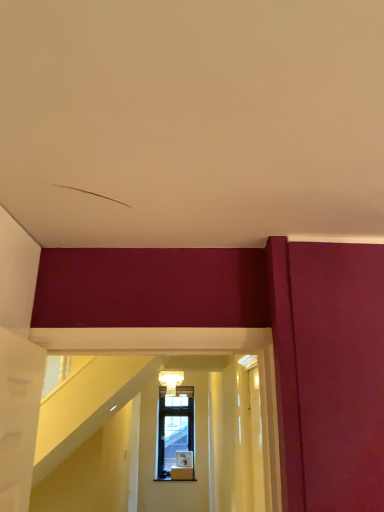
Image resolution: width=384 pixels, height=512 pixels. Describe the element at coordinates (171, 381) in the screenshot. I see `matte white light fixture at center` at that location.

What are the coordinates of `matte white light fixture at center` in the screenshot? It's located at (171, 381).

Describe the element at coordinates (251, 438) in the screenshot. The height and width of the screenshot is (512, 384). I see `transparent glass door at right` at that location.

What is the approximate height of transparent glass door at right?

It is 28.79 inches.

Where is `transparent glass door at right`? The width and height of the screenshot is (384, 512). transparent glass door at right is located at coordinates (251, 438).

Find the location of a particular element. matte white light fixture at center is located at coordinates (171, 381).

Is transparent glass door at right at the right side of matte white light fixture at center?

Correct, you'll find transparent glass door at right to the right of matte white light fixture at center.

Which is in front, transparent glass door at right or matte white light fixture at center?

transparent glass door at right is closer to the camera.

Considering the positions of point (247, 478) and point (173, 377), is point (247, 478) closer or farther from the camera than point (173, 377)?

Point (247, 478) appears to be closer to the viewer than point (173, 377).

From the image's perspective, is transparent glass door at right below matte white light fixture at center?

No.

From a real-world perspective, is transparent glass door at right physically above matte white light fixture at center?

No, from a real-world perspective, transparent glass door at right is not above matte white light fixture at center.

Considering the sizes of transparent glass door at right and matte white light fixture at center in the image, is transparent glass door at right wider or thinner than matte white light fixture at center?

In the image, transparent glass door at right appears to be more narrow than matte white light fixture at center.

Does transparent glass door at right have a lesser height compared to matte white light fixture at center?

No.

Can you confirm if transparent glass door at right is bigger than matte white light fixture at center?

Yes.

Is transparent glass door at right not inside matte white light fixture at center?

That's correct, transparent glass door at right is outside of matte white light fixture at center.

Are transparent glass door at right and matte white light fixture at center far apart?

Indeed, transparent glass door at right is not near matte white light fixture at center.

Is transparent glass door at right facing away from matte white light fixture at center?

transparent glass door at right does not have its back to matte white light fixture at center.

Where is `glass door on the right of matte white light fixture at center`? The image size is (384, 512). glass door on the right of matte white light fixture at center is located at coordinates (251, 438).

Does matte white light fixture at center appear on the left side of transparent glass door at right?

Indeed, matte white light fixture at center is positioned on the left side of transparent glass door at right.

Considering the relative positions of matte white light fixture at center and transparent glass door at right in the image provided, is matte white light fixture at center in front of transparent glass door at right?

That is False.

Is point (173, 376) more distant than point (250, 435)?

Yes, it is behind point (250, 435).

Consider the image. From the image's perspective, which is above, matte white light fixture at center or transparent glass door at right?

transparent glass door at right, from the image's perspective.

From a real-world perspective, is matte white light fixture at center positioned over transparent glass door at right based on gravity?

Yes.

Is matte white light fixture at center thinner than transparent glass door at right?

In fact, matte white light fixture at center might be wider than transparent glass door at right.

Looking at this image, does matte white light fixture at center have a greater height compared to transparent glass door at right?

No, matte white light fixture at center is not taller than transparent glass door at right.

In the scene shown: Can you confirm if matte white light fixture at center is bigger than transparent glass door at right?

No, matte white light fixture at center is not bigger than transparent glass door at right.

Would you say matte white light fixture at center is inside or outside transparent glass door at right?

matte white light fixture at center is spatially situated outside transparent glass door at right.

Would you say matte white light fixture at center is a long distance from transparent glass door at right?

Yes.

Is transparent glass door at right at the back of matte white light fixture at center?

That's not correct — matte white light fixture at center is not looking away from transparent glass door at right.

How many degrees apart are the facing directions of matte white light fixture at center and transparent glass door at right?

88.2 degrees separate the facing orientations of matte white light fixture at center and transparent glass door at right.

This screenshot has height=512, width=384. Find the location of `glass door on the right of matte white light fixture at center`. glass door on the right of matte white light fixture at center is located at coordinates (251, 438).

Where is `glass door on the right of matte white light fixture at center`? The height and width of the screenshot is (512, 384). glass door on the right of matte white light fixture at center is located at coordinates (251, 438).

In the image, there is a transparent glass door at right. At what (x,y) coordinates should I click in order to perform the action: click on light fixture below it (from the image's perspective). Please return your answer as a coordinate pair (x, y). This screenshot has width=384, height=512. Looking at the image, I should click on (171, 381).